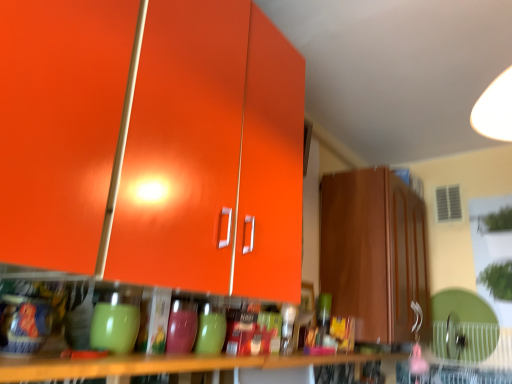
Question: From a real-world perspective, is glossy orange cabinet at upper left, placed as the 2th cabinetry when sorted from back to front, positioned above or below wooden table at lower center?

Choices:
 (A) below
 (B) above

Answer: (B)

Question: Looking at their shapes, would you say glossy orange cabinet at upper left, the 2th cabinetry viewed from the right, is wider or thinner than wooden table at lower center?

Choices:
 (A) thin
 (B) wide

Answer: (B)

Question: Which of these objects is positioned farthest from the wooden table at lower center?

Choices:
 (A) matte brown cabinet at right, the second cabinetry when ordered from left to right
 (B) glossy orange cabinet at upper left, which is the 1th cabinetry from left to right

Answer: (A)

Question: Which object is the closest to the wooden table at lower center?

Choices:
 (A) matte brown cabinet at right, the first cabinetry viewed from the right
 (B) glossy orange cabinet at upper left, the 2th cabinetry viewed from the right

Answer: (B)